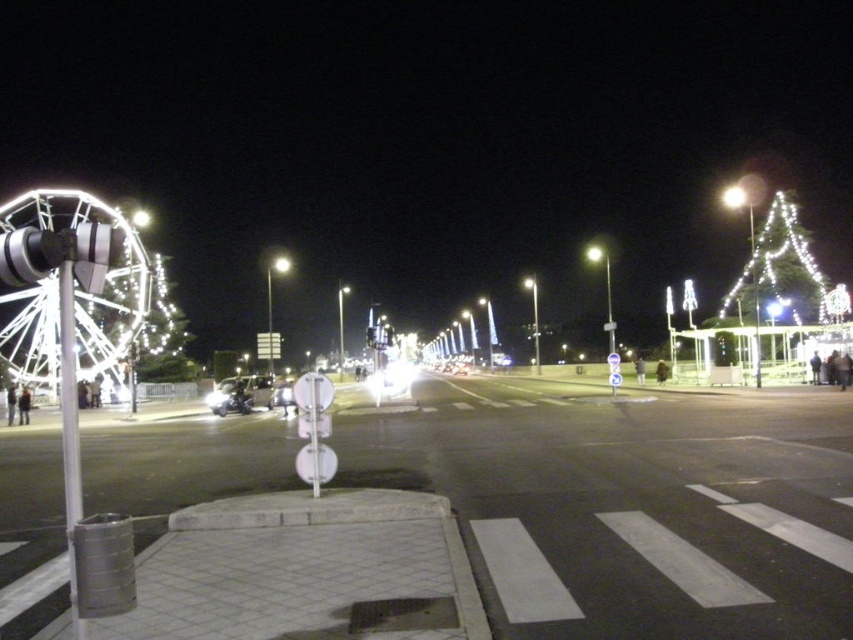
You are standing at the center of the pedestrian crossing and want to place a new decorative light pole exactly halfway between the illuminated plastic tree at right and the Ferris wheel. Given that the Ferris wheel is located to the left, can you determine the coordinates where the light pole should be placed?

The coordinates for the illuminated plastic tree at right are given as point (x=779, y=268). Since the Ferris wheel is to the left, its coordinates would be lower in the x or y axis. To find the midpoint between the two points, you would need to average their coordinates. However, without knowing the Ferris wheel coordinates, it is impossible to determine the exact midpoint.